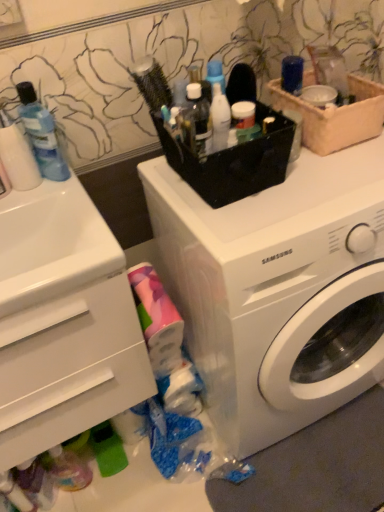
Question: Does white plastic drawer at lower left appear on the left side of beige woven basket at upper right?

Choices:
 (A) no
 (B) yes

Answer: (B)

Question: Does white plastic drawer at lower left have a lesser height compared to beige woven basket at upper right?

Choices:
 (A) no
 (B) yes

Answer: (A)

Question: Is white plastic drawer at lower left outside beige woven basket at upper right?

Choices:
 (A) no
 (B) yes

Answer: (B)

Question: Is white plastic drawer at lower left thinner than beige woven basket at upper right?

Choices:
 (A) yes
 (B) no

Answer: (B)

Question: From a real-world perspective, is white plastic drawer at lower left positioned over beige woven basket at upper right based on gravity?

Choices:
 (A) no
 (B) yes

Answer: (A)

Question: Is beige woven basket at upper right inside white plastic drawer at lower left?

Choices:
 (A) no
 (B) yes

Answer: (A)

Question: Considering the relative sizes of translucent plastic bottle at center, the 1th toiletry in the right-to-left sequence, and white plastic drawer at lower left in the image provided, is translucent plastic bottle at center, the 1th toiletry in the right-to-left sequence, wider than white plastic drawer at lower left?

Choices:
 (A) yes
 (B) no

Answer: (B)

Question: Can you confirm if translucent plastic bottle at center, which is counted as the second toiletry, starting from the left, is smaller than white plastic drawer at lower left?

Choices:
 (A) no
 (B) yes

Answer: (B)

Question: Would you say translucent plastic bottle at center, the 1th toiletry in the right-to-left sequence, contains white plastic drawer at lower left?

Choices:
 (A) yes
 (B) no

Answer: (B)

Question: Is the position of translucent plastic bottle at center, which is counted as the second toiletry, starting from the left, more distant than that of white plastic drawer at lower left?

Choices:
 (A) no
 (B) yes

Answer: (B)

Question: From the image's perspective, would you say translucent plastic bottle at center, the 1th toiletry in the right-to-left sequence, is shown under white plastic drawer at lower left?

Choices:
 (A) yes
 (B) no

Answer: (B)

Question: Can you confirm if translucent plastic bottle at center, which is counted as the second toiletry, starting from the left, is positioned to the left of white plastic drawer at lower left?

Choices:
 (A) yes
 (B) no

Answer: (B)

Question: Is white plastic washing machine at center surrounding translucent plastic bottle at center, which is counted as the second toiletry, starting from the left?

Choices:
 (A) no
 (B) yes

Answer: (A)